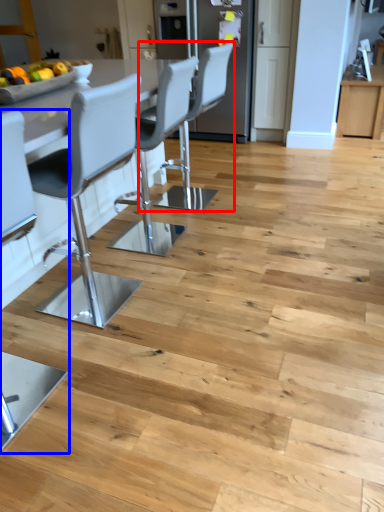
Question: Which of the following is the farthest to the observer, chair (highlighted by a red box) or chair (highlighted by a blue box)?

Choices:
 (A) chair
 (B) chair

Answer: (A)